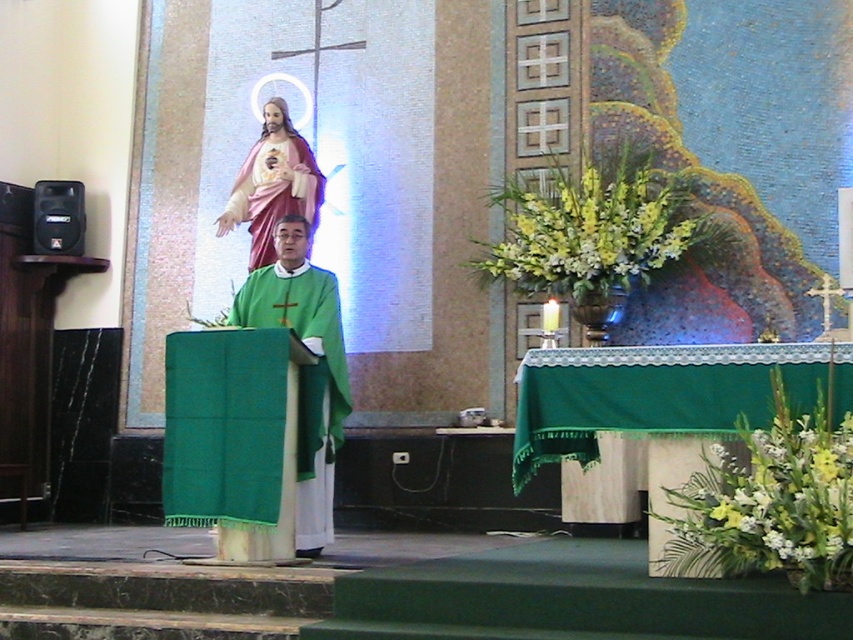
You are a photographer standing at the entrance of the church. You want to take a photo of the priest at point (314, 352) and the religious icon of Jesus at point (260, 257). Will both subjects be visible in the frame if you position yourself so that the priest is centered?

Yes, both the priest at point (314, 352) and the religious icon of Jesus at point (260, 257) will be visible because the priest is in front of the icon, so positioning the priest at the center would still allow the icon to be in the background of the frame.

You are a photographer standing at the back of the church. You want to take a photo of the green clothed priest at center during the ceremony. If your camera has a maximum focus range of 6 meters, will you be able to capture the priest clearly?

The green clothed priest at center is 6.52 meters from camera. Since the camera can only focus up to 6 meters, it will not be able to capture the priest clearly.